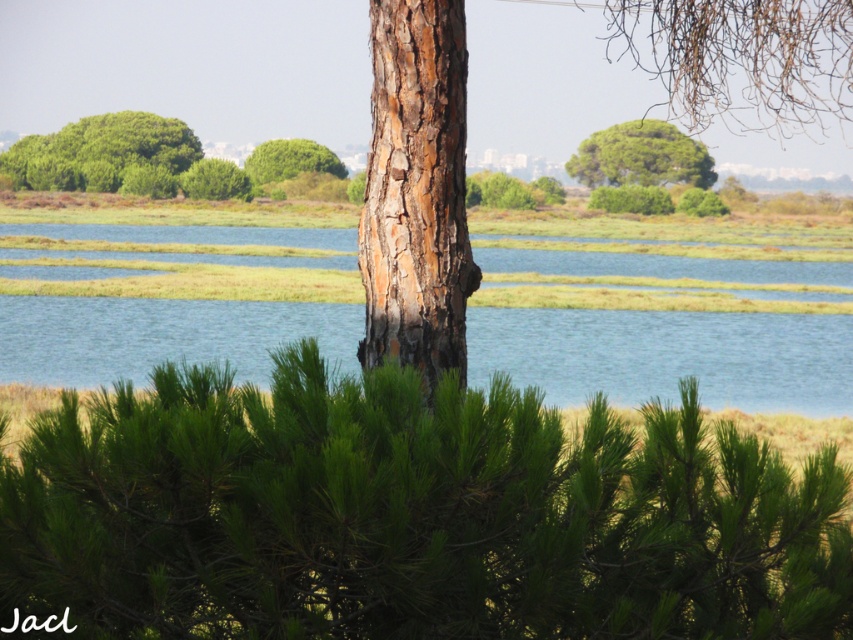
You are a bird looking for a place to perch. You see two trees in the scene. Which tree, the green leafy tree at upper center or the green leafy tree at center, would you choose if you prefer a larger tree to rest on?

The green leafy tree at upper center is bigger than the green leafy tree at center, so you should choose the green leafy tree at upper center to perch on.

You are standing in the natural landscape and want to take a photo of both the green leafy tree at upper center and the green leafy tree at center. Which tree should you focus on first if you want to capture both in your camera frame?

You should focus on the green leafy tree at center first because it is closer to you than the green leafy tree at upper center, which is above it and farther away.